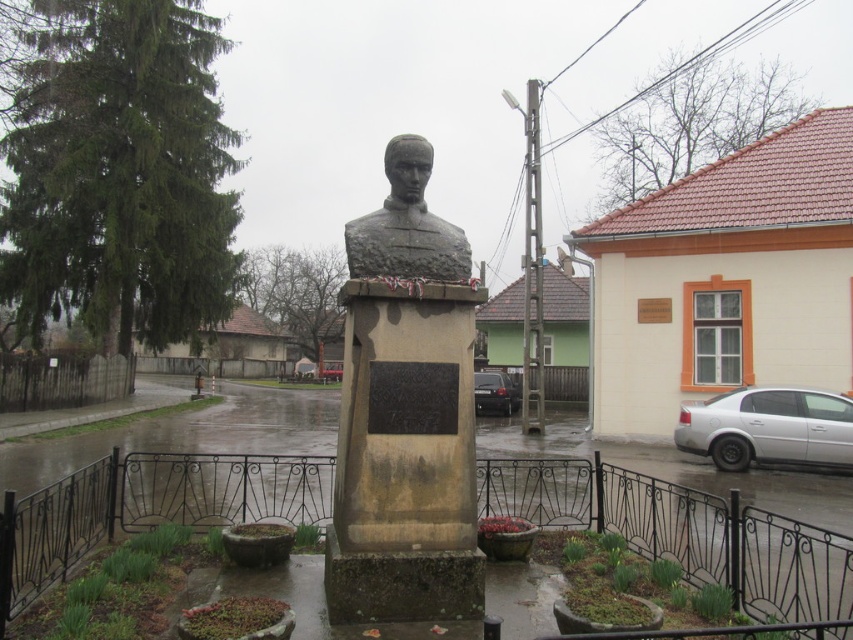
Question: Which object is the farthest from the silver metallic car at lower right?

Choices:
 (A) black glossy car at center
 (B) stone bust at center

Answer: (B)

Question: Does stone bust at center have a greater width compared to black glossy car at center?

Choices:
 (A) yes
 (B) no

Answer: (B)

Question: Is stone bust at center to the right of slate stone bust at center from the viewer's perspective?

Choices:
 (A) no
 (B) yes

Answer: (A)

Question: Which point is farther from the camera taking this photo?

Choices:
 (A) 479,378
 (B) 416,224
 (C) 364,444
 (D) 711,413

Answer: (A)

Question: Does silver metallic car at lower right have a smaller size compared to black glossy car at center?

Choices:
 (A) no
 (B) yes

Answer: (B)

Question: Which point is farther from the camera taking this photo?

Choices:
 (A) (410, 204)
 (B) (372, 401)
 (C) (503, 404)

Answer: (C)